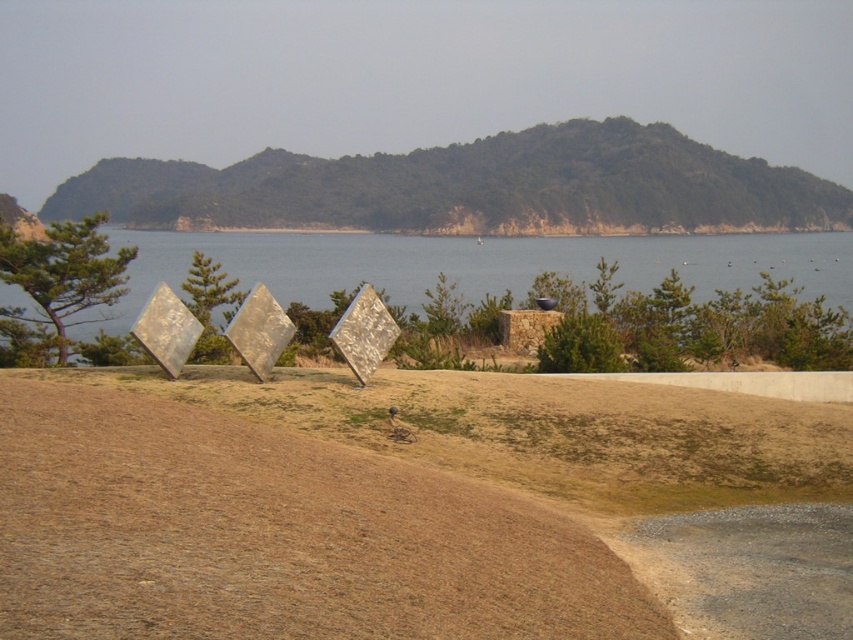
You are standing at the base of the modern art installation in the foreground of the coastal landscape. You want to take a photo that includes both the art installation and a specific point in the distance. The point you want to include is labeled as point (x=473, y=188). What object is located at this point?

The green textured hillside at upper center is located at point (x=473, y=188).

Consider the image. You are standing in front of the modern art installation and want to take a photo that includes both the point at coordinates point [656,179] and point [714,273]. Which point should you focus on to ensure both are in sharp focus?

You should focus on point [656,179] because it is closer to the camera than point [714,273], ensuring both are within the depth of field.

You are an artist planning to paint the scene from the perspective of someone standing near the art installation. You want to ensure the green textured hillside at upper center and the blue water at center are both visible in your painting. Based on their positions, which object should appear higher up in your painting?

The green textured hillside at upper center should appear higher up in the painting because it is positioned over the blue water at center, indicating it is located above it in the scene.